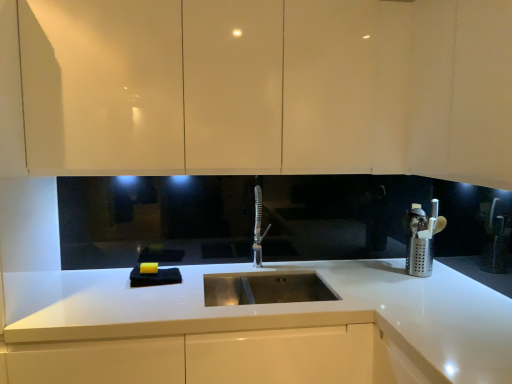
This screenshot has height=384, width=512. What are the coordinates of `silver perforated utensil holder at right` in the screenshot? It's located at (422, 239).

Image resolution: width=512 pixels, height=384 pixels. I want to click on satin nickel faucet at center, so click(x=258, y=228).

The width and height of the screenshot is (512, 384). Describe the element at coordinates (258, 228) in the screenshot. I see `satin nickel faucet at center` at that location.

The height and width of the screenshot is (384, 512). Describe the element at coordinates (257, 88) in the screenshot. I see `matte white cabinets at upper center` at that location.

Identify the location of silver perforated utensil holder at right. (422, 239).

Is white glossy countertop at center turned away from silver perforated utensil holder at right?

No, white glossy countertop at center is not facing the opposite direction of silver perforated utensil holder at right.

Would you say white glossy countertop at center is outside silver perforated utensil holder at right?

Yes, white glossy countertop at center is outside of silver perforated utensil holder at right.

Between white glossy countertop at center and silver perforated utensil holder at right, which one is positioned in front?

white glossy countertop at center is in front.

From a real-world perspective, is silver perforated utensil holder at right below white glossy countertop at center?

No, from a real-world perspective, silver perforated utensil holder at right is not under white glossy countertop at center.

From the image's perspective, does silver perforated utensil holder at right appear higher than white glossy countertop at center?

Correct, silver perforated utensil holder at right appears higher than white glossy countertop at center in the image.

Is silver perforated utensil holder at right located outside white glossy countertop at center?

Absolutely, silver perforated utensil holder at right is external to white glossy countertop at center.

Based on the photo, is silver perforated utensil holder at right next to white glossy countertop at center?

No, silver perforated utensil holder at right is not making contact with white glossy countertop at center.

Is white glossy countertop at center placed right next to matte white cabinets at upper center?

There is a gap between white glossy countertop at center and matte white cabinets at upper center.

Considering the sizes of objects white glossy countertop at center and matte white cabinets at upper center in the image provided, who is wider, white glossy countertop at center or matte white cabinets at upper center?

With larger width is white glossy countertop at center.

From the image's perspective, is white glossy countertop at center located beneath matte white cabinets at upper center?

Yes, from the image's perspective, white glossy countertop at center is beneath matte white cabinets at upper center.

Measure the distance between white glossy countertop at center and matte white cabinets at upper center.

They are 28.58 inches apart.

Considering the relative sizes of matte white cabinets at upper center and silver perforated utensil holder at right in the image provided, is matte white cabinets at upper center bigger than silver perforated utensil holder at right?

Yes, matte white cabinets at upper center is bigger than silver perforated utensil holder at right.

In terms of width, does matte white cabinets at upper center look wider or thinner when compared to silver perforated utensil holder at right?

Clearly, matte white cabinets at upper center has more width compared to silver perforated utensil holder at right.

Consider the image. From a real-world perspective, is matte white cabinets at upper center positioned under silver perforated utensil holder at right based on gravity?

Actually, matte white cabinets at upper center is physically above silver perforated utensil holder at right in the real world.

Which object is further away from the camera, matte white cabinets at upper center or silver perforated utensil holder at right?

silver perforated utensil holder at right is further from the camera.

Is silver perforated utensil holder at right not near matte white cabinets at upper center?

silver perforated utensil holder at right is near matte white cabinets at upper center, not far away.

Could you tell me if silver perforated utensil holder at right is turned towards matte white cabinets at upper center?

No, silver perforated utensil holder at right is not oriented towards matte white cabinets at upper center.

Is silver perforated utensil holder at right to the left of matte white cabinets at upper center from the viewer's perspective?

No.

Is silver perforated utensil holder at right wider than matte white cabinets at upper center?

In fact, silver perforated utensil holder at right might be narrower than matte white cabinets at upper center.

How distant is satin nickel faucet at center from matte white cabinets at upper center?

They are 27.81 inches apart.

Is satin nickel faucet at center facing towards matte white cabinets at upper center?

No.

Considering the sizes of objects satin nickel faucet at center and matte white cabinets at upper center in the image provided, who is bigger, satin nickel faucet at center or matte white cabinets at upper center?

→ With larger size is matte white cabinets at upper center.

From a real-world perspective, which object stands above the other?

matte white cabinets at upper center, from a real-world perspective.

Which is behind, point (450, 179) or point (254, 242)?

The point (254, 242) is farther from the camera.

From the image's perspective, which is above, matte white cabinets at upper center or satin nickel faucet at center?

From the image's view, matte white cabinets at upper center is above.

From a real-world perspective, is matte white cabinets at upper center beneath satin nickel faucet at center?

Actually, matte white cabinets at upper center is physically above satin nickel faucet at center in the real world.

Is matte white cabinets at upper center not close to satin nickel faucet at center?

No, matte white cabinets at upper center is not far away from satin nickel faucet at center.

At what (x,y) coordinates should I click in order to perform the action: click on countertop below the silver perforated utensil holder at right (from the image's perspective). Please return your answer as a coordinate pair (x, y). The height and width of the screenshot is (384, 512). Looking at the image, I should click on (277, 324).

In the image, there is a silver perforated utensil holder at right. Identify the location of countertop below it (from a real-world perspective). The width and height of the screenshot is (512, 384). pyautogui.click(x=277, y=324).

Based on their spatial positions, is white glossy countertop at center or silver perforated utensil holder at right closer to satin nickel faucet at center?

white glossy countertop at center lies closer to satin nickel faucet at center than the other object.

Estimate the real-world distances between objects in this image. Which object is closer to satin nickel faucet at center, matte white cabinets at upper center or white glossy countertop at center?

white glossy countertop at center is positioned closer to the anchor satin nickel faucet at center.

Looking at this image, looking at the image, which one is located closer to white glossy countertop at center, matte white cabinets at upper center or silver perforated utensil holder at right?

silver perforated utensil holder at right lies closer to white glossy countertop at center than the other object.

When comparing their distances from silver perforated utensil holder at right, does satin nickel faucet at center or matte white cabinets at upper center seem further?

matte white cabinets at upper center is positioned further to the anchor silver perforated utensil holder at right.

Based on their spatial positions, is satin nickel faucet at center or matte white cabinets at upper center further from white glossy countertop at center?

matte white cabinets at upper center.

Estimate the real-world distances between objects in this image. Which object is closer to silver perforated utensil holder at right, white glossy countertop at center or satin nickel faucet at center?

white glossy countertop at center is positioned closer to the anchor silver perforated utensil holder at right.

Looking at the image, which one is located further to matte white cabinets at upper center, white glossy countertop at center or satin nickel faucet at center?

The object further to matte white cabinets at upper center is white glossy countertop at center.

In the scene shown: When comparing their distances from matte white cabinets at upper center, does white glossy countertop at center or silver perforated utensil holder at right seem further?

silver perforated utensil holder at right is further to matte white cabinets at upper center.

Where is `countertop between satin nickel faucet at center and silver perforated utensil holder at right`? Image resolution: width=512 pixels, height=384 pixels. countertop between satin nickel faucet at center and silver perforated utensil holder at right is located at coordinates (277, 324).

Identify the location of tap situated between matte white cabinets at upper center and silver perforated utensil holder at right from left to right. (258, 228).

You are a GUI agent. You are given a task and a screenshot of the screen. Output one action in this format:
    pyautogui.click(x=<x>, y=<y>)
    Task: Click on the tap between matte white cabinets at upper center and white glossy countertop at center from top to bottom
    
    Given the screenshot: What is the action you would take?
    pyautogui.click(x=258, y=228)

I want to click on appliance that lies between matte white cabinets at upper center and white glossy countertop at center from top to bottom, so click(x=422, y=239).